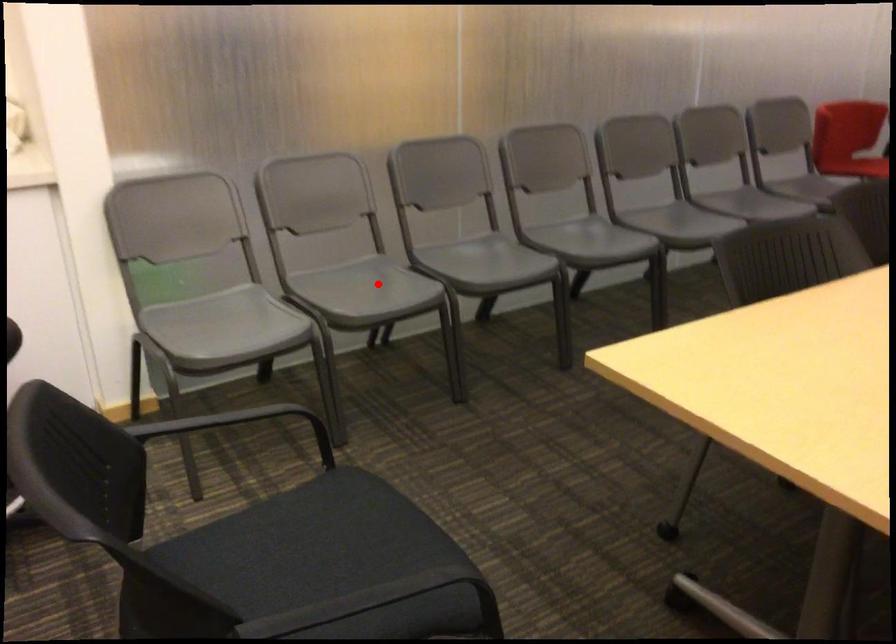
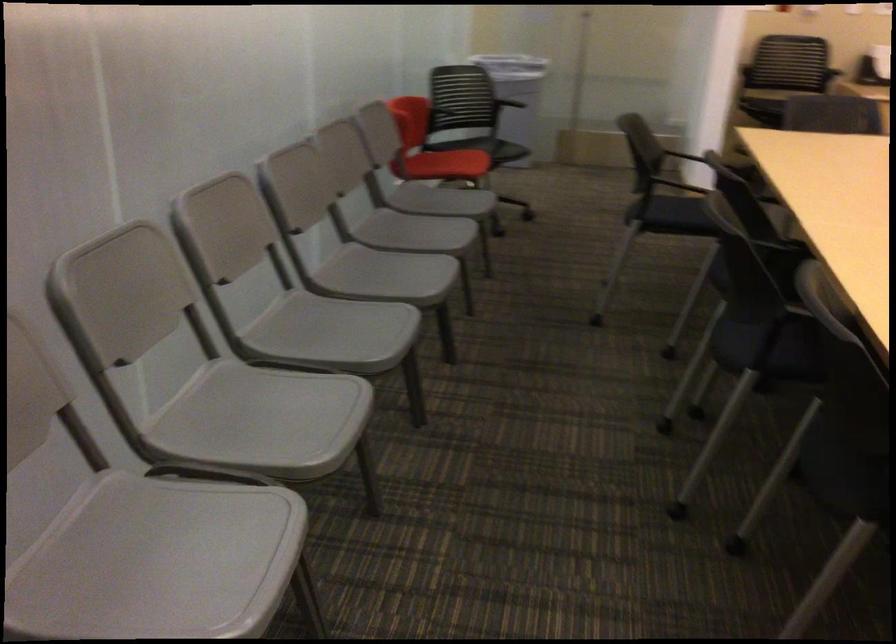
Question: I am providing you with two images of the same scene from different viewpoints. A red point is marked on the first image. Can you still see the location of the red point in image 2?

Choices:
 (A) Yes
 (B) No

Answer: (A)